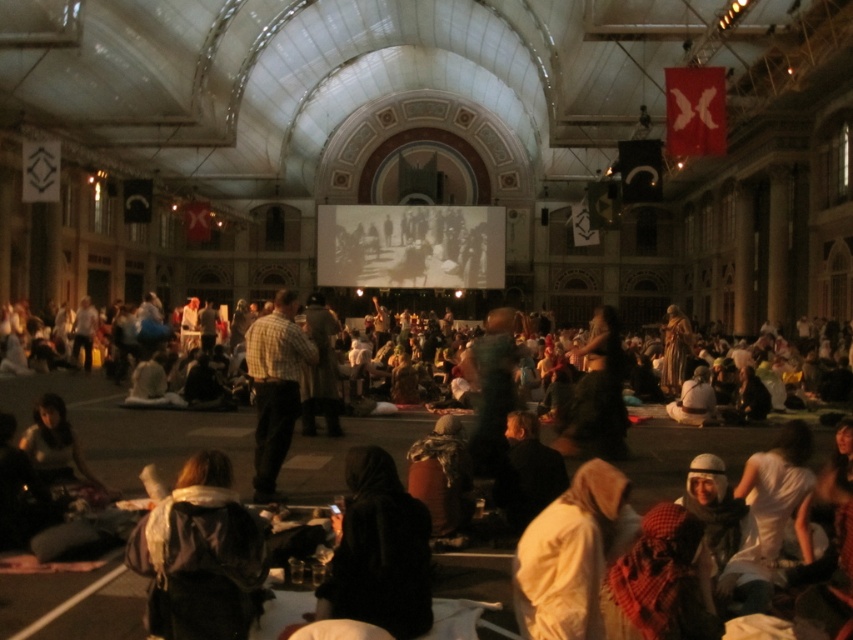
You are a photographer standing in the central area of the hall. You need to take a photo that includes both the dark brown leather jacket at lower left and the light beige fabric at lower right. Which object should you position closer to the camera to ensure both are fully visible in the frame?

Since the dark brown leather jacket at lower left is not as tall as the light beige fabric at lower right, you should position the dark brown leather jacket at lower left closer to the camera to ensure both objects are fully visible in the frame.

You are standing at the entrance of the hall and notice two fabrics in the central area. The light beige fabric at lower right and the checkered fabric shirt at center. Which fabric is closer to you?

The light beige fabric at lower right is closer to you because it is in front of the checkered fabric shirt at center.